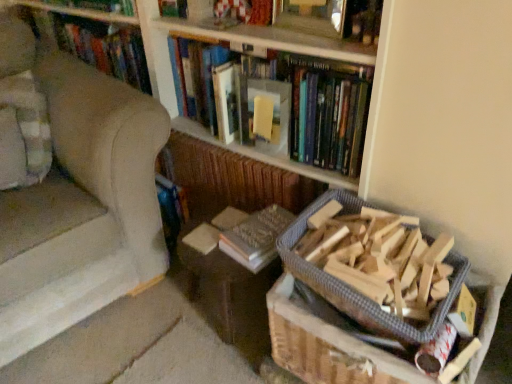
Question: Can you confirm if brown cardboard box at lower right is shorter than wooden frame at upper center, which is the 1th book in top-to-bottom order?

Choices:
 (A) no
 (B) yes

Answer: (A)

Question: Is brown cardboard box at lower right beside wooden frame at upper center, acting as the 3th book starting from the bottom?

Choices:
 (A) yes
 (B) no

Answer: (B)

Question: Considering the relative sizes of brown cardboard box at lower right and wooden frame at upper center, acting as the 3th book starting from the bottom, in the image provided, is brown cardboard box at lower right taller than wooden frame at upper center, acting as the 3th book starting from the bottom,?

Choices:
 (A) yes
 (B) no

Answer: (A)

Question: Is brown cardboard box at lower right facing away from wooden frame at upper center, acting as the 3th book starting from the bottom?

Choices:
 (A) yes
 (B) no

Answer: (B)

Question: Considering the relative sizes of brown cardboard box at lower right and wooden frame at upper center, which is the 1th book in top-to-bottom order, in the image provided, is brown cardboard box at lower right smaller than wooden frame at upper center, which is the 1th book in top-to-bottom order,?

Choices:
 (A) no
 (B) yes

Answer: (A)

Question: Considering the relative sizes of brown cardboard box at lower right and wooden frame at upper center, acting as the 3th book starting from the bottom, in the image provided, is brown cardboard box at lower right bigger than wooden frame at upper center, acting as the 3th book starting from the bottom,?

Choices:
 (A) yes
 (B) no

Answer: (A)

Question: From the image's perspective, is brown cardboard box at lower right on top of hardcover book at upper center, the second book positioned from the bottom?

Choices:
 (A) yes
 (B) no

Answer: (B)

Question: Is brown cardboard box at lower right thinner than hardcover book at upper center, the second book positioned from the bottom?

Choices:
 (A) yes
 (B) no

Answer: (B)

Question: From the image's perspective, is brown cardboard box at lower right beneath hardcover book at upper center, which is the second book from top to bottom?

Choices:
 (A) yes
 (B) no

Answer: (A)

Question: Is brown cardboard box at lower right at the right side of hardcover book at upper center, the second book positioned from the bottom?

Choices:
 (A) yes
 (B) no

Answer: (A)

Question: Does brown cardboard box at lower right come behind hardcover book at upper center, which is the second book from top to bottom?

Choices:
 (A) no
 (B) yes

Answer: (A)

Question: Can you confirm if brown cardboard box at lower right is shorter than hardcover book at upper center, the second book positioned from the bottom?

Choices:
 (A) no
 (B) yes

Answer: (B)

Question: Is brown cardboard box at lower right directly adjacent to beige fabric armchair at left?

Choices:
 (A) no
 (B) yes

Answer: (A)